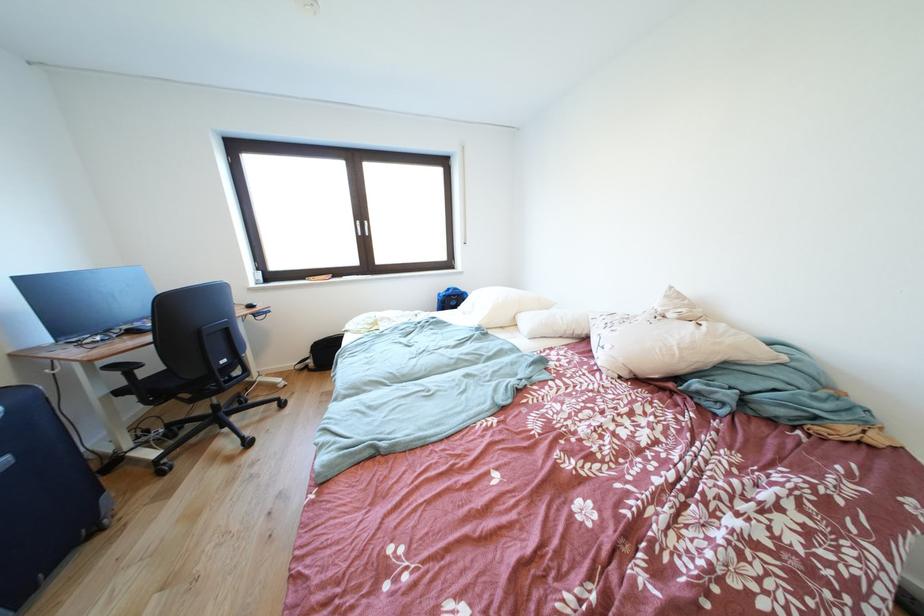
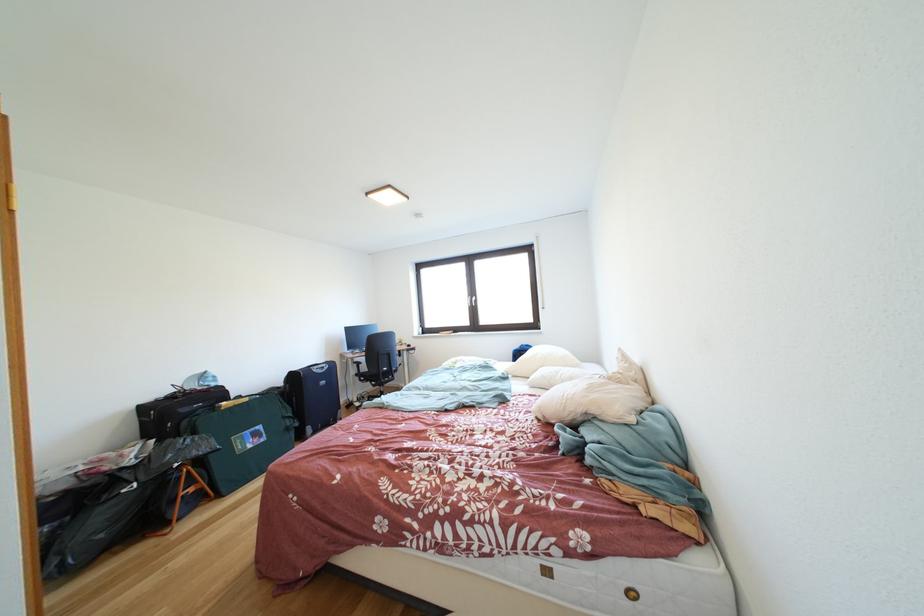
In the second image, find the point that corresponds to the point at 634,379 in the first image.

(549, 421)